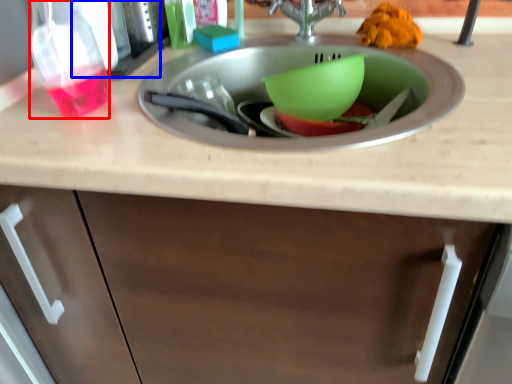
Question: Which object appears farthest to the camera in this image, bottle (highlighted by a red box) or appliance (highlighted by a blue box)?

Choices:
 (A) bottle
 (B) appliance

Answer: (B)